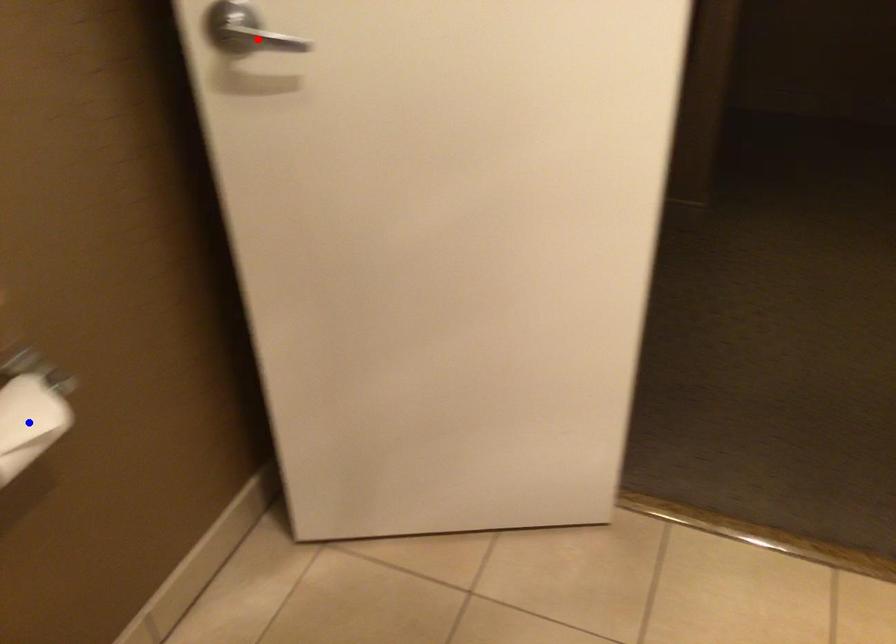
Question: Which of the two points in the image is closer to the camera?

Choices:
 (A) Blue point is closer.
 (B) Red point is closer.

Answer: (A)